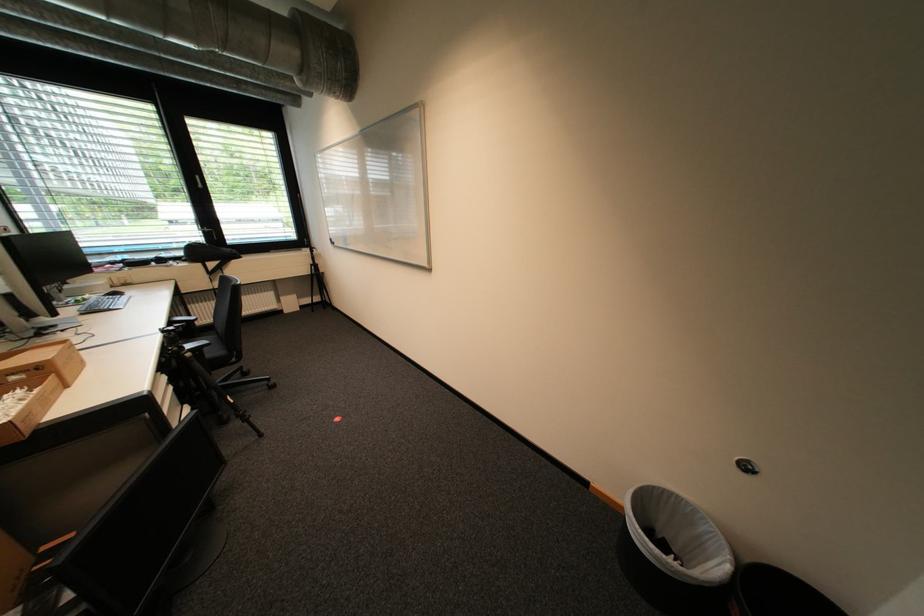
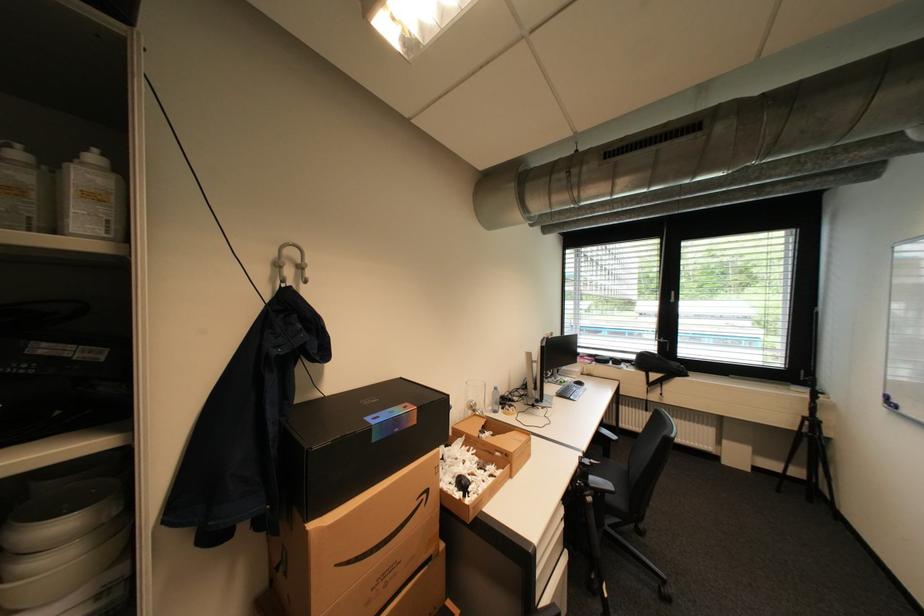
The point at (185, 349) is marked in the first image. Where is the corresponding point in the second image?

(591, 485)